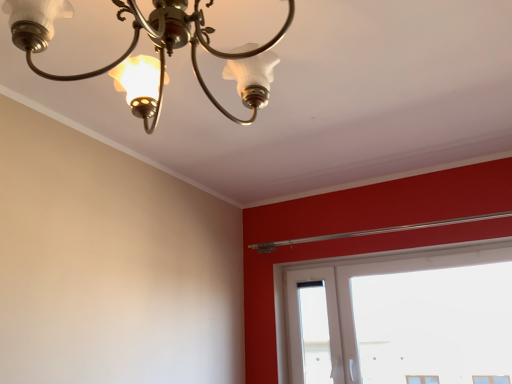
Question: Considering the relative sizes of matte glass chandelier at upper left and white plastic window at lower right in the image provided, is matte glass chandelier at upper left shorter than white plastic window at lower right?

Choices:
 (A) yes
 (B) no

Answer: (A)

Question: From a real-world perspective, is matte glass chandelier at upper left positioned under white plastic window at lower right based on gravity?

Choices:
 (A) no
 (B) yes

Answer: (A)

Question: Does matte glass chandelier at upper left have a lesser width compared to white plastic window at lower right?

Choices:
 (A) yes
 (B) no

Answer: (B)

Question: Does matte glass chandelier at upper left have a larger size compared to white plastic window at lower right?

Choices:
 (A) no
 (B) yes

Answer: (A)

Question: Is matte glass chandelier at upper left in front of white plastic window at lower right?

Choices:
 (A) yes
 (B) no

Answer: (A)

Question: Is matte glass chandelier at upper left looking in the opposite direction of white plastic window at lower right?

Choices:
 (A) yes
 (B) no

Answer: (B)

Question: Is white plastic window at lower right with matte glass chandelier at upper left?

Choices:
 (A) no
 (B) yes

Answer: (A)

Question: Is white plastic window at lower right closer to the viewer compared to matte glass chandelier at upper left?

Choices:
 (A) no
 (B) yes

Answer: (A)

Question: Considering the relative sizes of white plastic window at lower right and matte glass chandelier at upper left in the image provided, is white plastic window at lower right thinner than matte glass chandelier at upper left?

Choices:
 (A) no
 (B) yes

Answer: (B)

Question: From a real-world perspective, does white plastic window at lower right stand above matte glass chandelier at upper left?

Choices:
 (A) no
 (B) yes

Answer: (A)

Question: Can you confirm if white plastic window at lower right is positioned to the right of matte glass chandelier at upper left?

Choices:
 (A) yes
 (B) no

Answer: (A)

Question: Is white plastic window at lower right at the left side of matte glass chandelier at upper left?

Choices:
 (A) no
 (B) yes

Answer: (A)

Question: Is point (358, 350) closer or farther from the camera than point (164, 16)?

Choices:
 (A) farther
 (B) closer

Answer: (A)